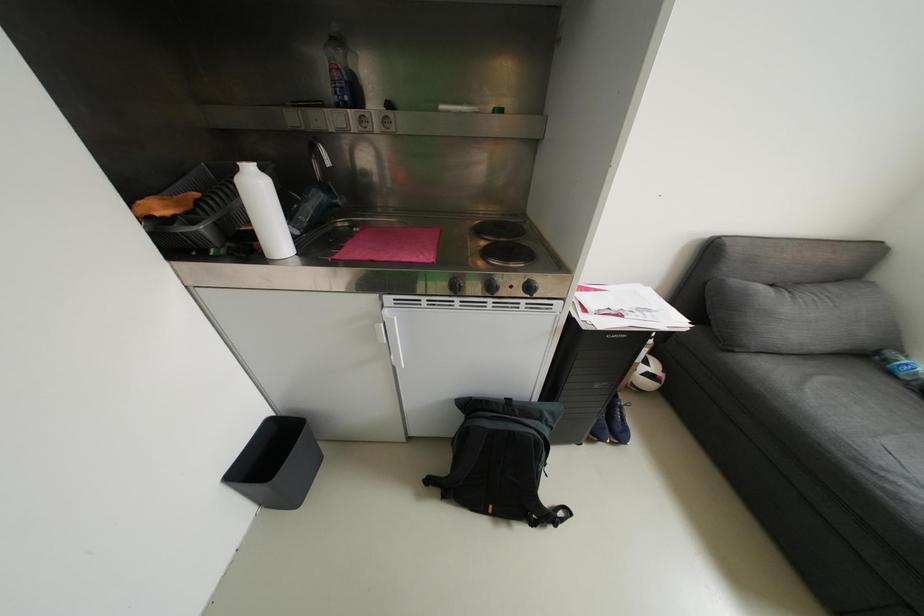
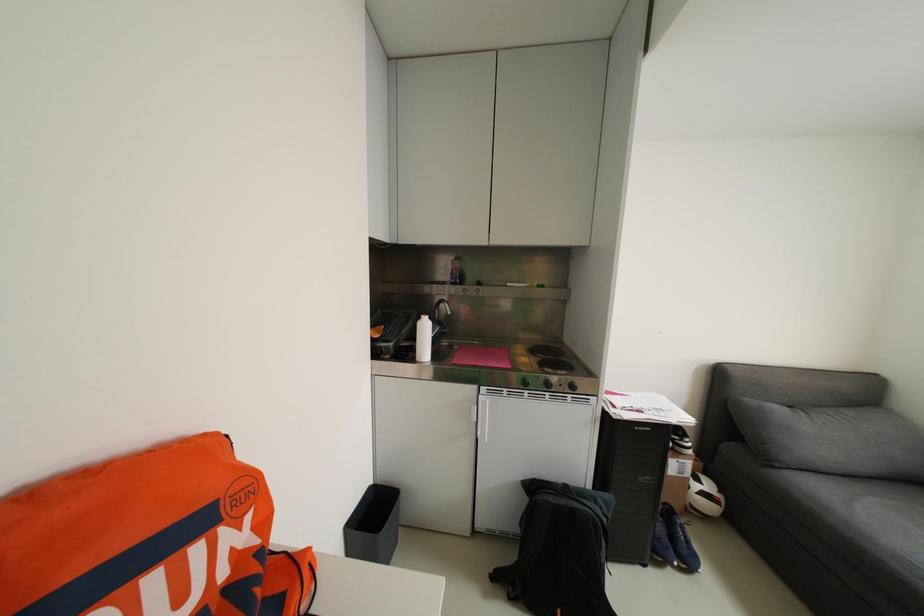
Question: What movement of the cameraman would produce the second image?

Choices:
 (A) Left
 (B) Right
 (C) Forward
 (D) Backward

Answer: (D)